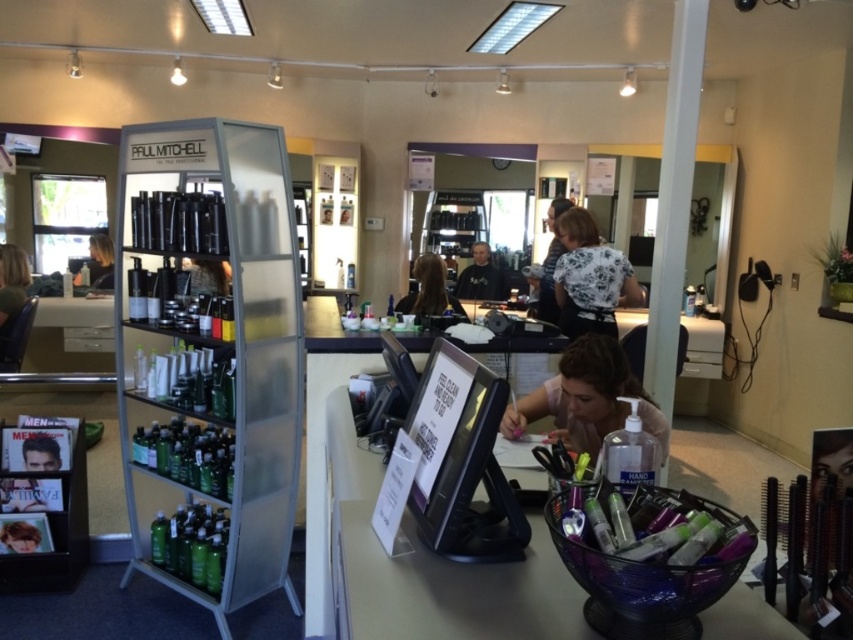
Which is more to the right, white floral blouse at center or green matte hair product at lower left?

From the viewer's perspective, white floral blouse at center appears more on the right side.

Can you confirm if white floral blouse at center is positioned below green matte hair product at lower left?

Incorrect, white floral blouse at center is not positioned below green matte hair product at lower left.

Is point (618, 289) farther from viewer compared to point (41, 433)?

Yes, point (618, 289) is farther from viewer.

Find the location of a particular element. The image size is (853, 640). white floral blouse at center is located at coordinates (590, 278).

This screenshot has width=853, height=640. Describe the element at coordinates (10, 300) in the screenshot. I see `blonde hair at left` at that location.

Does blonde hair at left have a smaller size compared to green matte hair product at lower left?

Incorrect, blonde hair at left is not smaller in size than green matte hair product at lower left.

Image resolution: width=853 pixels, height=640 pixels. Describe the element at coordinates (10, 300) in the screenshot. I see `blonde hair at left` at that location.

Identify the location of blonde hair at left. Image resolution: width=853 pixels, height=640 pixels. (10, 300).

Who is shorter, blonde hair at left or black hair at center?

black hair at center

Is point (16, 280) in front of point (485, 284)?

That is True.

Who is more distant from viewer, (15,280) or (479,257)?

The point (479,257) is more distant.

At what (x,y) coordinates should I click in order to perform the action: click on blonde hair at left. Please return your answer as a coordinate pair (x, y). The height and width of the screenshot is (640, 853). Looking at the image, I should click on (10, 300).